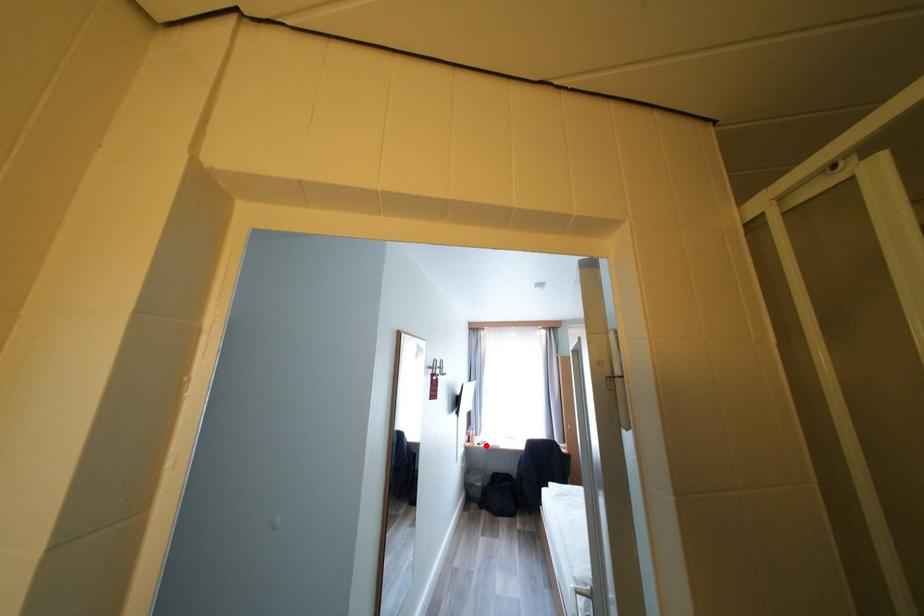
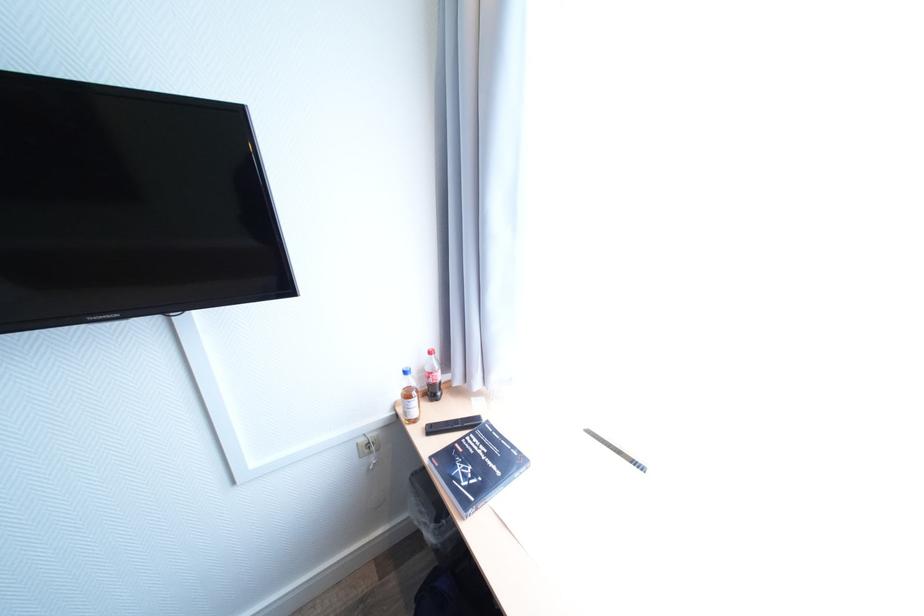
The point at the highlighted location is marked in the first image. Where is the corresponding point in the second image?

(439, 430)